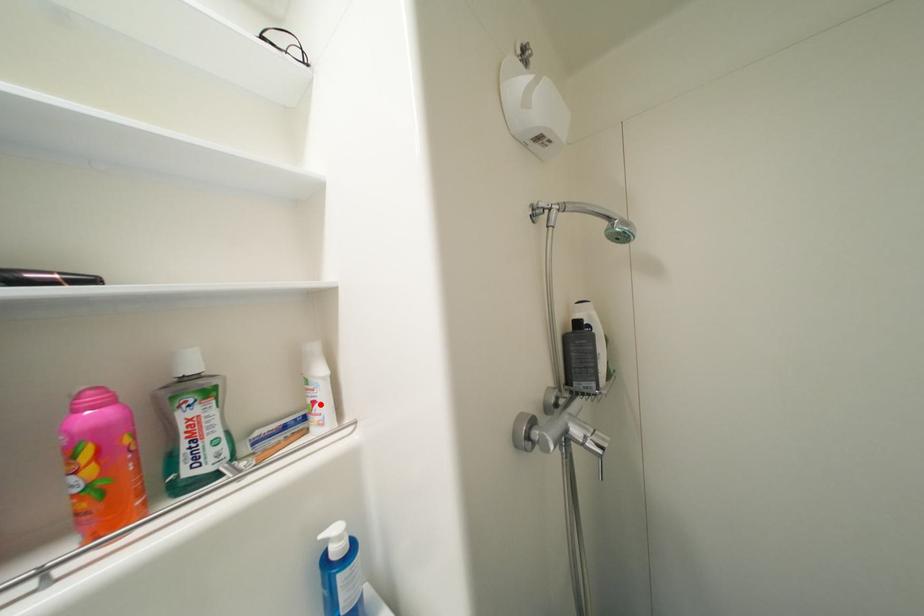
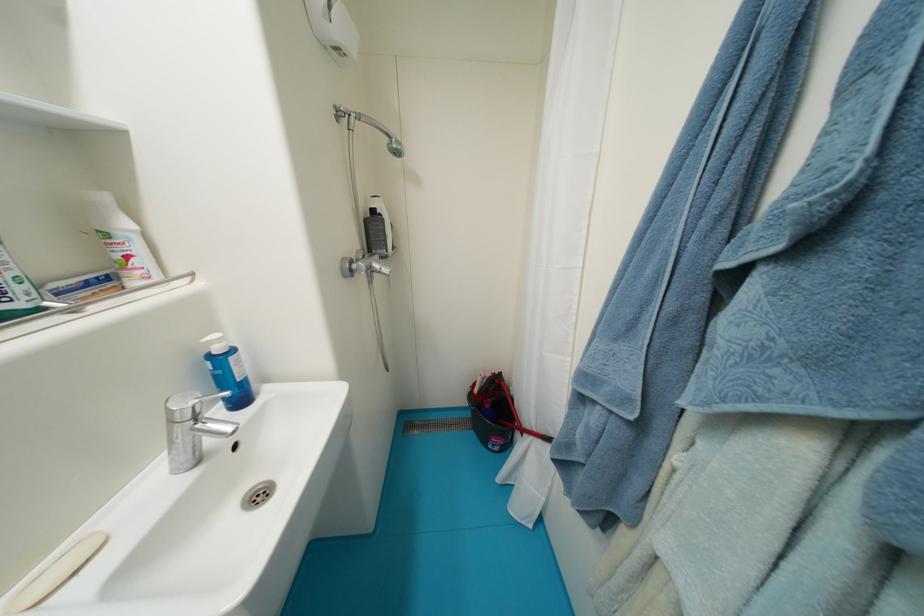
The point at the highlighted location is marked in the first image. Where is the corresponding point in the second image?

(134, 259)